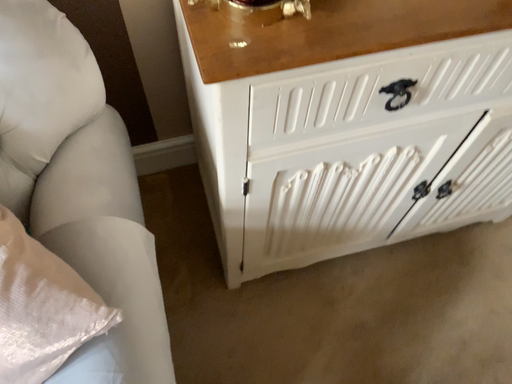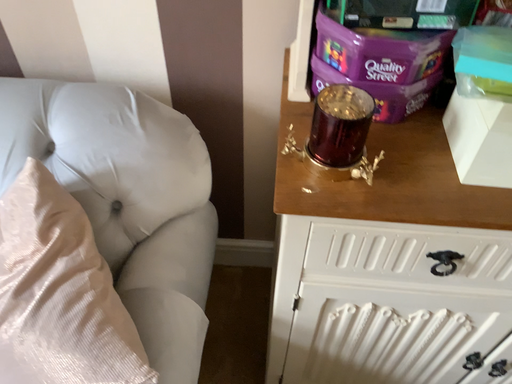
Question: Which way did the camera rotate in the video?

Choices:
 (A) rotated left
 (B) rotated right

Answer: (A)